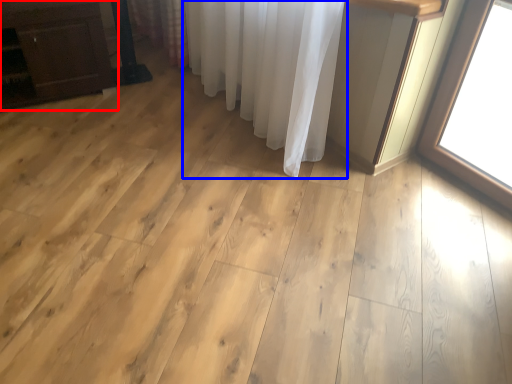
Question: Which point is further to the camera, furniture (highlighted by a red box) or curtain (highlighted by a blue box)?

Choices:
 (A) furniture
 (B) curtain

Answer: (A)